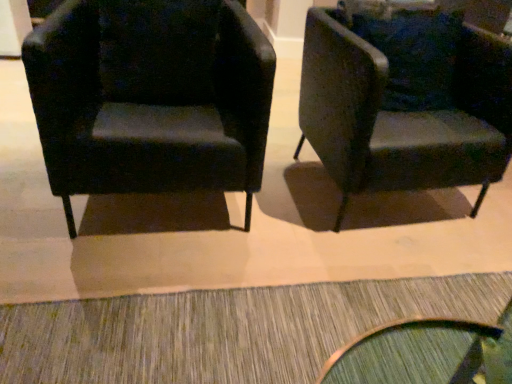
Identify the location of vacant area situated below textured gray doormat at lower center (from a real-world perspective). Image resolution: width=512 pixels, height=384 pixels. (278, 334).